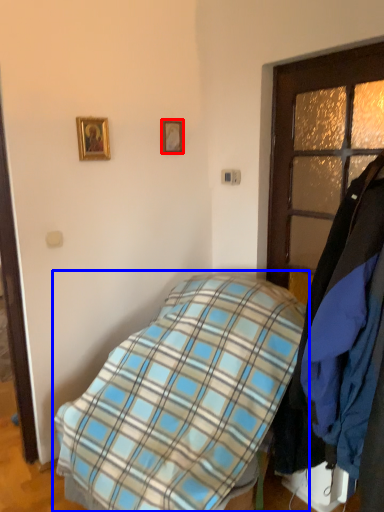
Question: Which object appears farthest to the camera in this image, picture frame (highlighted by a red box) or bed (highlighted by a blue box)?

Choices:
 (A) picture frame
 (B) bed

Answer: (A)